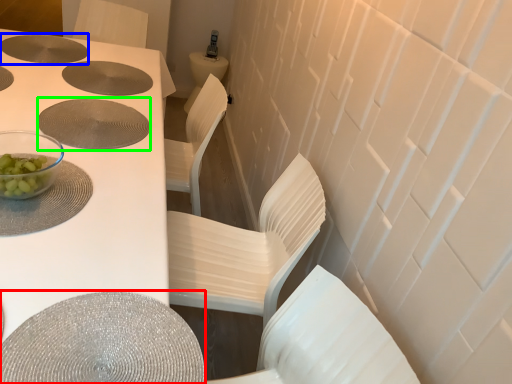
Question: Estimate the real-world distances between objects in this image. Which object is closer to round table (highlighted by a red box), hole (highlighted by a blue box) or hole (highlighted by a green box)?

Choices:
 (A) hole
 (B) hole

Answer: (B)